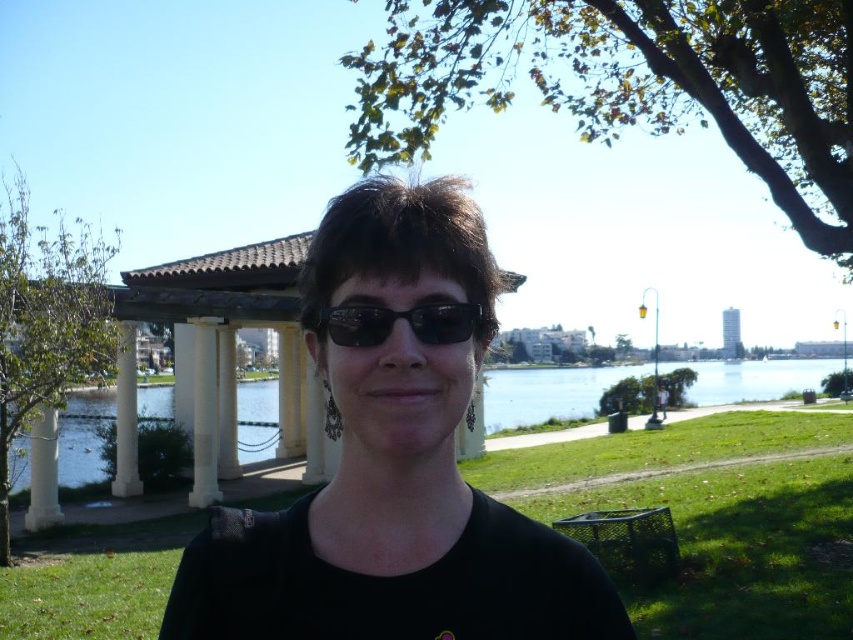
Question: Can you confirm if black matte shirt at center is positioned below black plastic sunglasses at center?

Choices:
 (A) yes
 (B) no

Answer: (A)

Question: Estimate the real-world distances between objects in this image. Which object is farther from the black matte shirt at center?

Choices:
 (A) clear blue water at center
 (B) black plastic sunglasses at center

Answer: (A)

Question: Can you confirm if clear blue water at center is thinner than black plastic sunglasses at center?

Choices:
 (A) yes
 (B) no

Answer: (B)

Question: Which object is the farthest from the black matte shirt at center?

Choices:
 (A) black plastic sunglasses at center
 (B) clear blue water at center

Answer: (B)

Question: Which point is closer to the camera taking this photo?

Choices:
 (A) (483, 561)
 (B) (358, 323)

Answer: (B)

Question: Is black matte shirt at center in front of clear blue water at center?

Choices:
 (A) no
 (B) yes

Answer: (B)